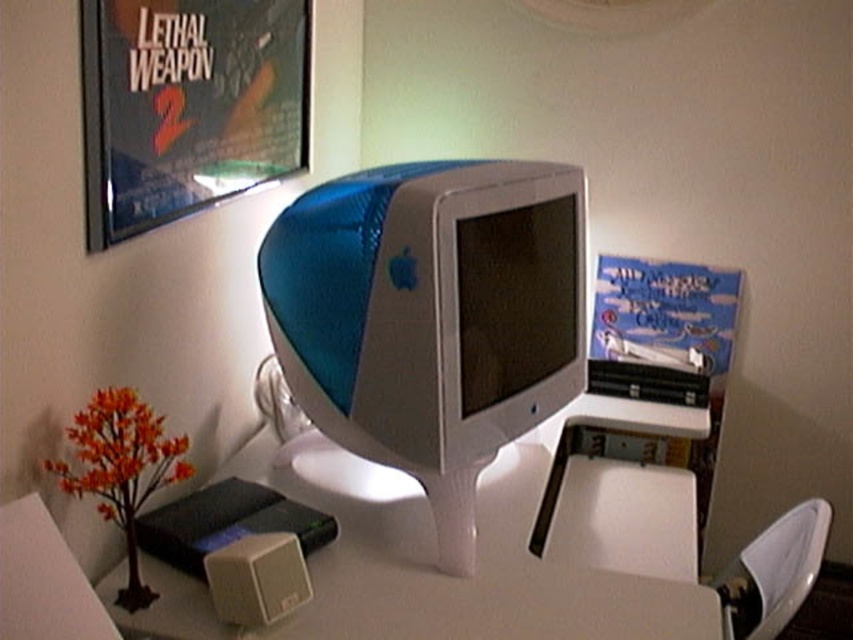
Based on the photo, you are organizing a tech exhibit and need to place a label next to the blue plastic monitor at center. The label must be positioned so it doesn not cover the matte plastic poster at upper left. Where should you place the label?

The blue plastic monitor at center is to the right of the matte plastic poster at upper left, so placing the label to the right of the blue plastic monitor at center would keep it away from the poster.

You are standing in front of the retro computer desk and want to place a new object. You have two points marked on the desk where you can place it. The points are point (300, 392) and point (152, 177). Which point is closer to you?

Point (300, 392) is further to the viewer than point (152, 177), so point (152, 177) is closer to you.